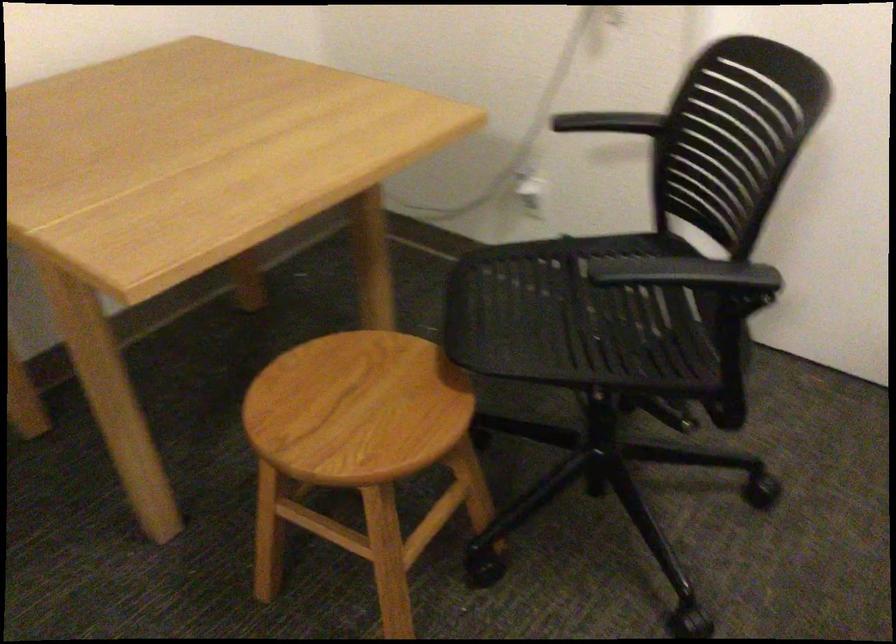
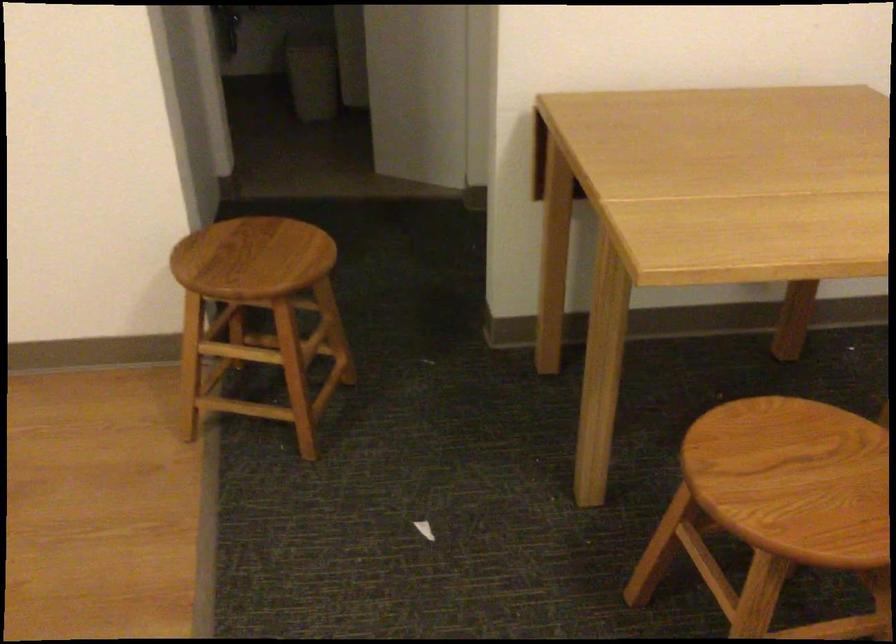
Question: The camera is either moving clockwise (left) or counter-clockwise (right) around the object. The first image is from the beginning of the video and the second image is from the end. Is the camera moving left or right when shooting the video?

Choices:
 (A) Left
 (B) Right

Answer: (B)